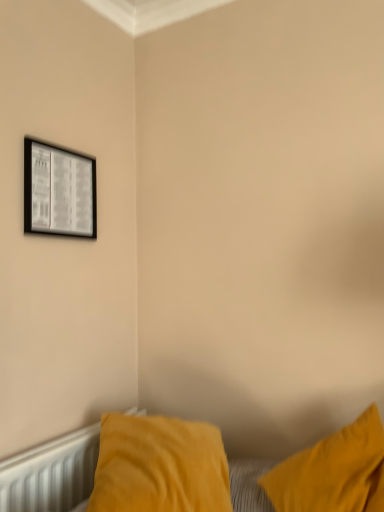
Question: From the image's perspective, is velvet yellow pillow at lower right located above or below black glossy picture frame at upper left?

Choices:
 (A) below
 (B) above

Answer: (A)

Question: In the image, is velvet yellow pillow at lower right positioned in front of or behind black glossy picture frame at upper left?

Choices:
 (A) front
 (B) behind

Answer: (A)

Question: Which of these objects is positioned farthest from the white textured radiator at lower left?

Choices:
 (A) black glossy picture frame at upper left
 (B) velvet yellow pillow at lower right

Answer: (A)

Question: Estimate the real-world distances between objects in this image. Which object is closer to the white textured radiator at lower left?

Choices:
 (A) velvet yellow pillow at lower right
 (B) black glossy picture frame at upper left

Answer: (A)